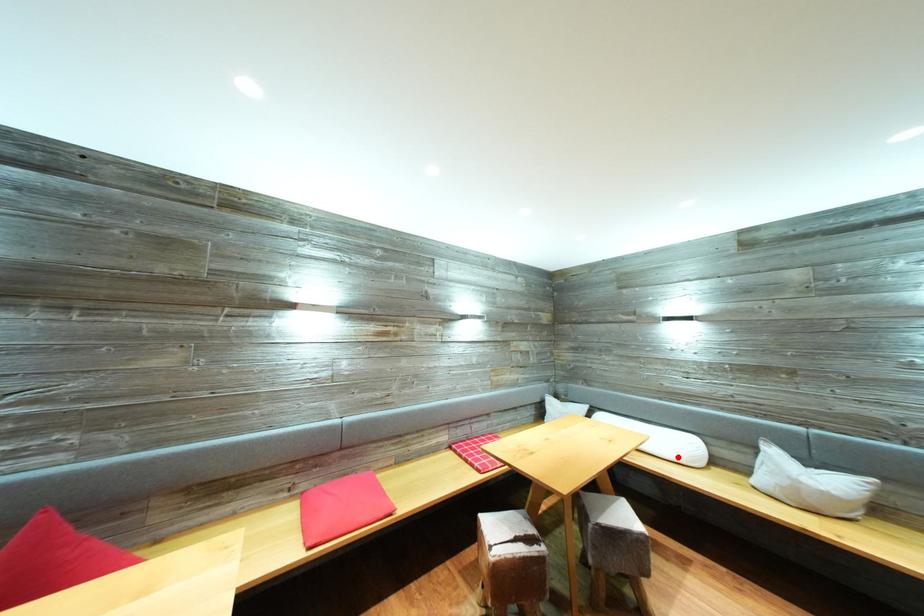
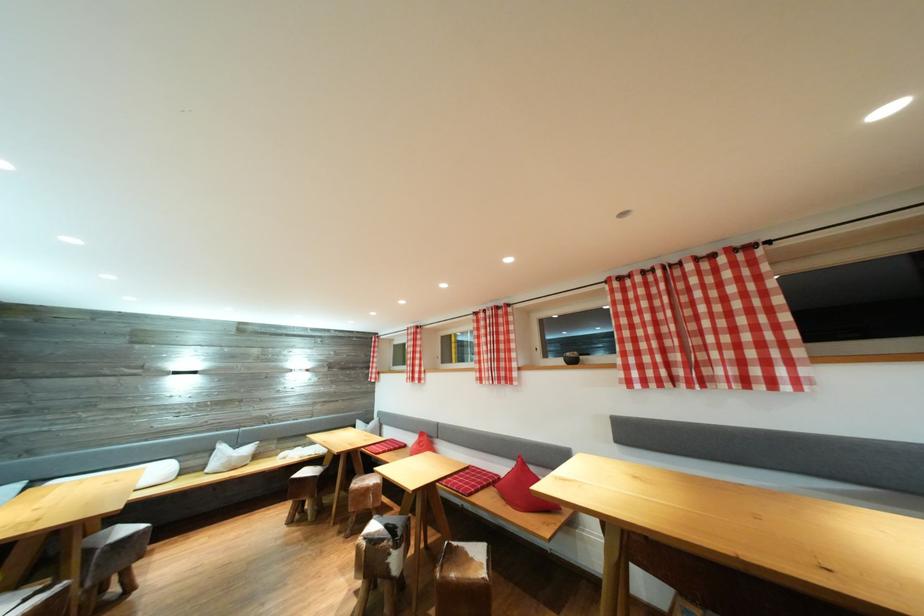
Question: I am providing you with two images of the same scene from different viewpoints. In image1, a red point is highlighted. Considering the same 3D point in image2, which of the following is correct?

Choices:
 (A) It is closer
 (B) It is farther

Answer: (B)